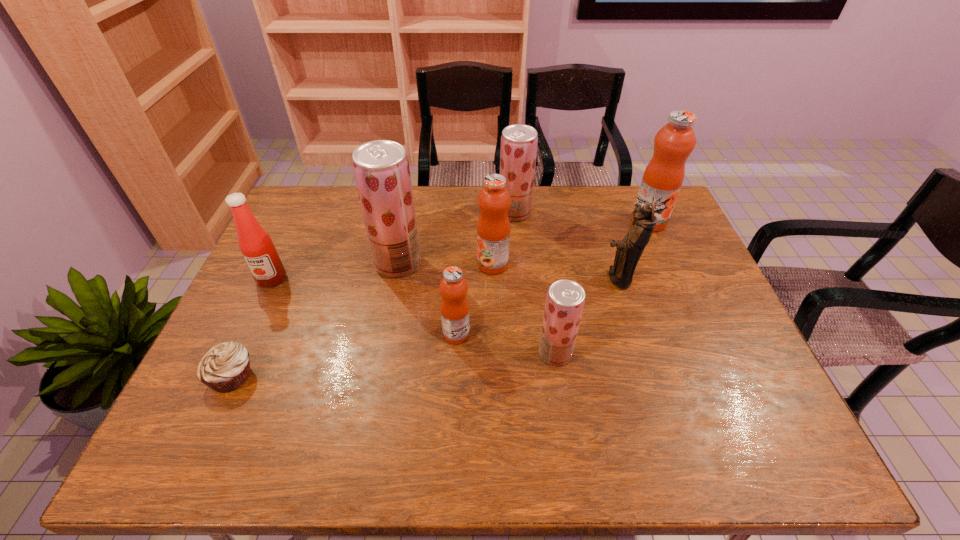
Where is `vacant space at the far edge of the desktop`? vacant space at the far edge of the desktop is located at coordinates (450, 198).

Locate an element on the screen. The width and height of the screenshot is (960, 540). free space at the near edge is located at coordinates (481, 450).

Find the location of `vacant space at the left edge of the desktop`. vacant space at the left edge of the desktop is located at coordinates (288, 268).

Identify the location of free space at the right edge. (705, 296).

Find the location of a particular element. vacant region at the far left corner of the desktop is located at coordinates (324, 211).

Locate an element on the screen. This screenshot has width=960, height=540. free space between the nearest strawberry fruit juice and the nearest orange fruit juice is located at coordinates (506, 343).

I want to click on blank region between the smallest orange fruit juice and the second smallest orange fruit juice, so click(474, 299).

Identify the location of free point between the biggest orange fruit juice and the red condiment. (460, 250).

The image size is (960, 540). Identify the location of vacant space that is in between the red condiment and the nearest orange fruit juice. (364, 306).

At what (x,y) coordinates should I click in order to perform the action: click on empty space that is in between the eighth object from left to right and the shortest object. Please return your answer as a coordinate pair (x, y). This screenshot has width=960, height=540. Looking at the image, I should click on (424, 327).